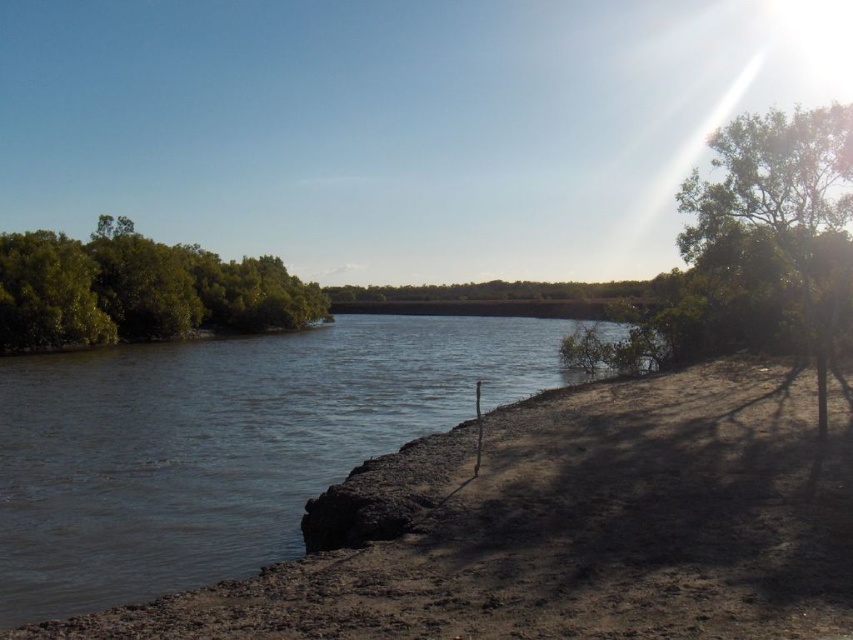
You are a photographer trying to capture the green leafy trees at left and the green leafy tree at right in a single frame. Based on their sizes in the image, which tree would appear closer to the camera?

The green leafy trees at left would appear closer to the camera because smaller objects in a photograph are typically closer, but according to the description, the green leafy trees at left is smaller than green leafy tree at right, which contradicts the usual perspective. Hence, the tree at the right is actually larger in reality but appears smaller in the image, meaning it is farther away. Wait, this is confusing. Let me correct that. Since the left trees are described as smaller in the image than the one

You are a photographer planning to capture the brown sedimentary river at center and the green leafy trees at left in a single shot. Based on their sizes, which object would appear more prominent in the photograph?

The green leafy trees at left would appear more prominent in the photograph because they are larger than the brown sedimentary river at center.